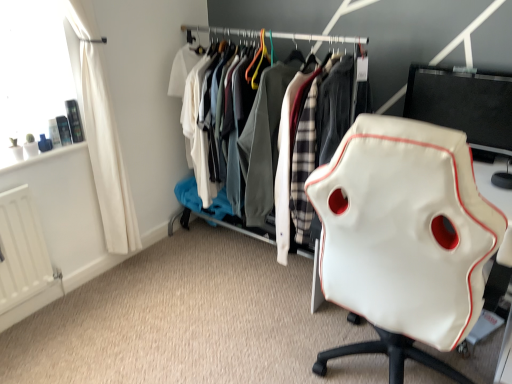
The height and width of the screenshot is (384, 512). Identify the location of white fabric curtain at left. (103, 137).

Where is `black glossy monitor at upper right`? black glossy monitor at upper right is located at coordinates (464, 105).

What do you see at coordinates (24, 259) in the screenshot? This screenshot has width=512, height=384. I see `white matte radiator at lower left` at bounding box center [24, 259].

Find the location of a particular element. The height and width of the screenshot is (384, 512). white matte radiator at lower left is located at coordinates (24, 259).

The image size is (512, 384). What are the coordinates of `white fabric curtain at left` in the screenshot? It's located at (103, 137).

Does white matte radiator at lower left appear on the left side of white leather chair at right?

Yes.

Between white matte radiator at lower left and white leather chair at right, which one has larger size?

Bigger between the two is white leather chair at right.

Choose the correct answer: Is white matte radiator at lower left inside white leather chair at right or outside it?

white matte radiator at lower left lies outside white leather chair at right.

Is there a large distance between white matte radiator at lower left and white leather chair at right?

Absolutely, white matte radiator at lower left is distant from white leather chair at right.

Considering the sizes of objects white leather jacket at center and black glossy monitor at upper right in the image provided, who is bigger, white leather jacket at center or black glossy monitor at upper right?

With larger size is white leather jacket at center.

Which is less distant, (222,128) or (502,110)?

Point (222,128) is positioned farther from the camera compared to point (502,110).

Is white leather jacket at center aimed at black glossy monitor at upper right?

No, white leather jacket at center does not turn towards black glossy monitor at upper right.

Looking at this image, considering the sizes of objects black glossy monitor at upper right and white matte radiator at lower left in the image provided, who is bigger, black glossy monitor at upper right or white matte radiator at lower left?

With larger size is black glossy monitor at upper right.

The width and height of the screenshot is (512, 384). I want to click on radiator below the black glossy monitor at upper right (from the image's perspective), so click(24, 259).

Based on the photo, in the image, is black glossy monitor at upper right on the left side or the right side of white matte radiator at lower left?

Clearly, black glossy monitor at upper right is on the right of white matte radiator at lower left in the image.

Is black glossy monitor at upper right oriented towards white matte radiator at lower left?

No, black glossy monitor at upper right is not turned towards white matte radiator at lower left.

Based on the photo, could white matte radiator at lower left be considered to be inside white fabric curtain at left?

No, white matte radiator at lower left is not a part of white fabric curtain at left.

Could you tell me if white fabric curtain at left is facing white matte radiator at lower left?

No.

Considering the relative positions of white fabric curtain at left and white matte radiator at lower left in the image provided, is white fabric curtain at left behind white matte radiator at lower left?

No, white fabric curtain at left is closer to the viewer.

Would you consider white fabric curtain at left to be distant from white matte radiator at lower left?

That's not correct — white fabric curtain at left is a little close to white matte radiator at lower left.

From the image's perspective, is white matte radiator at lower left located above or below black glossy monitor at upper right?

From the image's perspective, white matte radiator at lower left appears below black glossy monitor at upper right.

Is white matte radiator at lower left taller or shorter than black glossy monitor at upper right?

Clearly, white matte radiator at lower left is taller compared to black glossy monitor at upper right.

Is point (17, 278) farther from viewer compared to point (450, 72)?

Yes, point (17, 278) is farther from viewer.

Is white matte radiator at lower left oriented away from black glossy monitor at upper right?

No, white matte radiator at lower left is not facing the opposite direction of black glossy monitor at upper right.

Considering the sizes of black glossy monitor at upper right and white fabric curtain at left in the image, is black glossy monitor at upper right taller or shorter than white fabric curtain at left?

In the image, black glossy monitor at upper right appears to be shorter than white fabric curtain at left.

Is black glossy monitor at upper right in front of or behind white fabric curtain at left in the image?

In the image, black glossy monitor at upper right appears behind white fabric curtain at left.

Is point (437, 80) behind point (125, 180)?

No.

Considering the relative sizes of black glossy monitor at upper right and white fabric curtain at left in the image provided, is black glossy monitor at upper right wider than white fabric curtain at left?

No.

From the image's perspective, is white leather chair at right positioned above or below black glossy monitor at upper right?

white leather chair at right is situated lower than black glossy monitor at upper right in the image.

In terms of size, does white leather chair at right appear bigger or smaller than black glossy monitor at upper right?

Clearly, white leather chair at right is larger in size than black glossy monitor at upper right.

From a real-world perspective, relative to black glossy monitor at upper right, is white leather chair at right vertically above or below?

Clearly, from a real-world perspective, white leather chair at right is below black glossy monitor at upper right.

Relative to black glossy monitor at upper right, is white leather chair at right in front or behind?

white leather chair at right is positioned closer to the viewer than black glossy monitor at upper right.

Image resolution: width=512 pixels, height=384 pixels. I want to click on chair on the right of white matte radiator at lower left, so click(404, 238).

Identify the location of closet that is on the left side of black glossy monitor at upper right. The width and height of the screenshot is (512, 384). (285, 163).

Based on their spatial positions, is white leather chair at right or white matte radiator at lower left closer to white fabric curtain at left?

white matte radiator at lower left is positioned closer to the anchor white fabric curtain at left.

When comparing their distances from white matte radiator at lower left, does black glossy monitor at upper right or white fabric curtain at left seem closer?

white fabric curtain at left is positioned closer to the anchor white matte radiator at lower left.

Which object lies further to the anchor point white leather chair at right, white matte radiator at lower left or black glossy monitor at upper right?

white matte radiator at lower left is further to white leather chair at right.

Based on their spatial positions, is black glossy monitor at upper right or white leather chair at right closer to white matte radiator at lower left?

white leather chair at right is closer to white matte radiator at lower left.

Considering their positions, is white leather chair at right positioned closer to black glossy monitor at upper right than white leather jacket at center?

The object closer to black glossy monitor at upper right is white leather jacket at center.

Based on their spatial positions, is white fabric curtain at left or white leather chair at right further from black glossy monitor at upper right?

Among the two, white fabric curtain at left is located further to black glossy monitor at upper right.

Based on their spatial positions, is white leather chair at right or white leather jacket at center further from white fabric curtain at left?

Among the two, white leather chair at right is located further to white fabric curtain at left.

Based on the photo, based on their spatial positions, is white fabric curtain at left or black glossy monitor at upper right closer to white leather chair at right?

black glossy monitor at upper right lies closer to white leather chair at right than the other object.

Where is `closet between white fabric curtain at left and black glossy monitor at upper right in the horizontal direction`? The width and height of the screenshot is (512, 384). closet between white fabric curtain at left and black glossy monitor at upper right in the horizontal direction is located at coordinates (285, 163).

Locate an element on the screen. curtain between white matte radiator at lower left and black glossy monitor at upper right is located at coordinates (103, 137).

This screenshot has width=512, height=384. In order to click on desktop located between white leather chair at right and white leather jacket at center in the depth direction in this screenshot , I will do point(464,105).

The height and width of the screenshot is (384, 512). I want to click on closet between white matte radiator at lower left and black glossy monitor at upper right from left to right, so click(x=285, y=163).